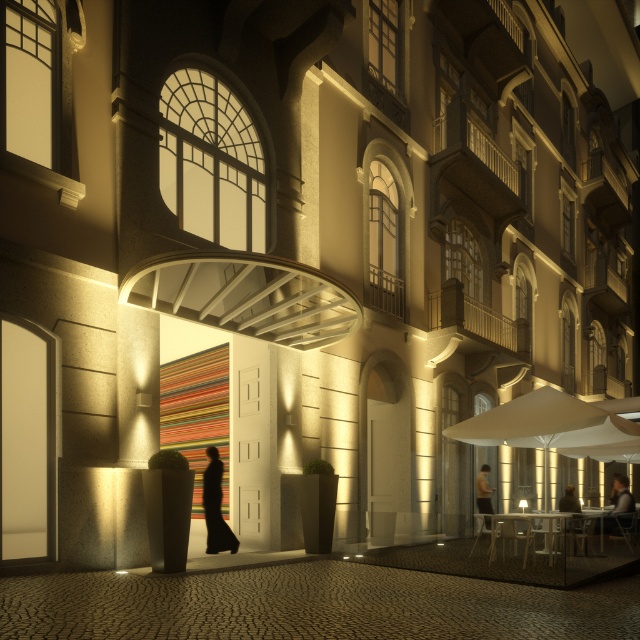
You are a photographer trying to capture the entrance of the grand building. You notice two people wearing dark gray sweater at lower right and dark brown leather jacket at lower right. Which one is taller?

The dark gray sweater at lower right is taller than the dark brown leather jacket at lower right.

You are a photographer trying to capture a clear shot of the grand building. You notice the black fabric person at center and the dark brown leather jacket at lower right are blocking your view. Based on their positions, which one is closer to the entrance of the building?

The black fabric person at center is closer to the entrance of the building because they are positioned to the left of the dark brown leather jacket at lower right, which is further to the right and thus farther from the entrance.